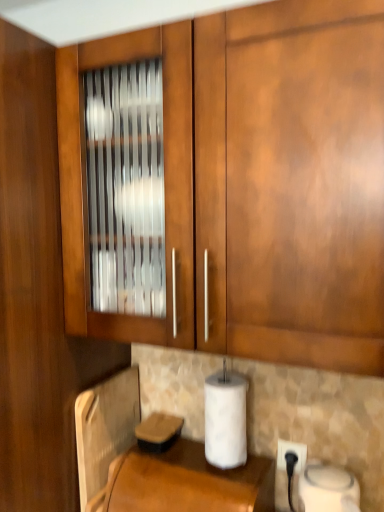
I want to click on free point above brown leather at lower center (from a real-world perspective), so click(192, 468).